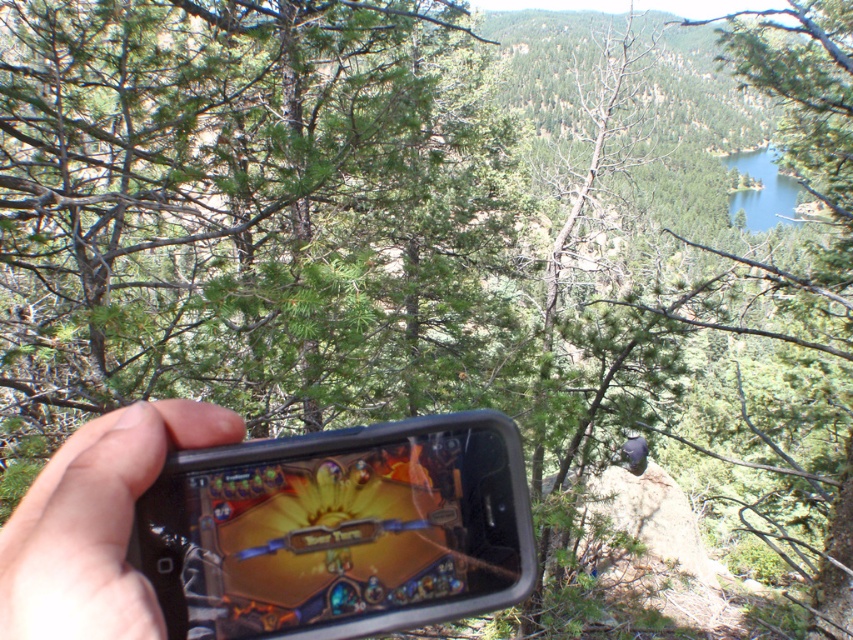
Question: Among these points, which one is nearest to the camera?

Choices:
 (A) pyautogui.click(x=227, y=552)
 (B) pyautogui.click(x=140, y=580)

Answer: (B)

Question: Is black plastic smartphone at center wider than black matte phone at lower left?

Choices:
 (A) yes
 (B) no

Answer: (A)

Question: In this image, where is black plastic smartphone at center located relative to black matte phone at lower left?

Choices:
 (A) above
 (B) below

Answer: (B)

Question: Which point is farther to the camera?

Choices:
 (A) black plastic smartphone at center
 (B) black matte phone at lower left

Answer: (A)

Question: Can you confirm if black plastic smartphone at center is thinner than black matte phone at lower left?

Choices:
 (A) no
 (B) yes

Answer: (A)

Question: Which of the following is the closest to the observer?

Choices:
 (A) black matte phone at lower left
 (B) black plastic smartphone at center

Answer: (A)